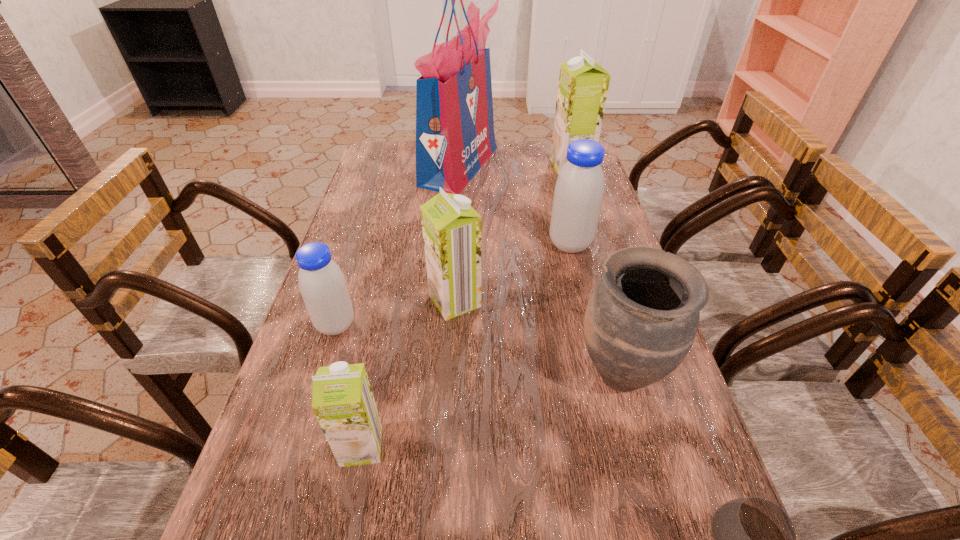
Locate an element on the screen. This screenshot has height=540, width=960. grocery bag situated at the far edge is located at coordinates (455, 136).

Identify the location of soya milk located in the far edge section of the desktop. (583, 85).

Identify the location of urn at the right edge. This screenshot has height=540, width=960. (641, 320).

Identify the location of object present at the far right corner. (583, 85).

This screenshot has width=960, height=540. I want to click on vacant position at the far edge of the desktop, so click(x=511, y=151).

Locate an element on the screen. vacant area at the left edge is located at coordinates (297, 352).

At what (x,y) coordinates should I click in order to perform the action: click on vacant space at the right edge of the desktop. Please return your answer as a coordinate pair (x, y). The height and width of the screenshot is (540, 960). Looking at the image, I should click on (554, 181).

Identify the location of vacant space at the far left corner of the desktop. Image resolution: width=960 pixels, height=540 pixels. (397, 158).

At what (x,y) coordinates should I click in order to perform the action: click on unoccupied position between the fourth nearest soya milk and the nearest green soya milk. Please return your answer as a coordinate pair (x, y). The height and width of the screenshot is (540, 960). Looking at the image, I should click on 466,345.

Locate which object is the third closest to the second tallest object. Please provide its 2D coordinates. Your answer should be formatted as a tuple, i.e. [(x, y)], where the tuple contains the x and y coordinates of a point satisfying the conditions above.

[(451, 228)]